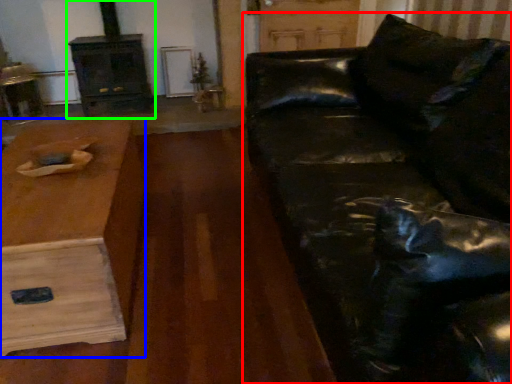
Question: Which object is positioned farthest from studio couch (highlighted by a red box)? Select from table (highlighted by a blue box) and fireplace (highlighted by a green box).

Choices:
 (A) table
 (B) fireplace

Answer: (B)